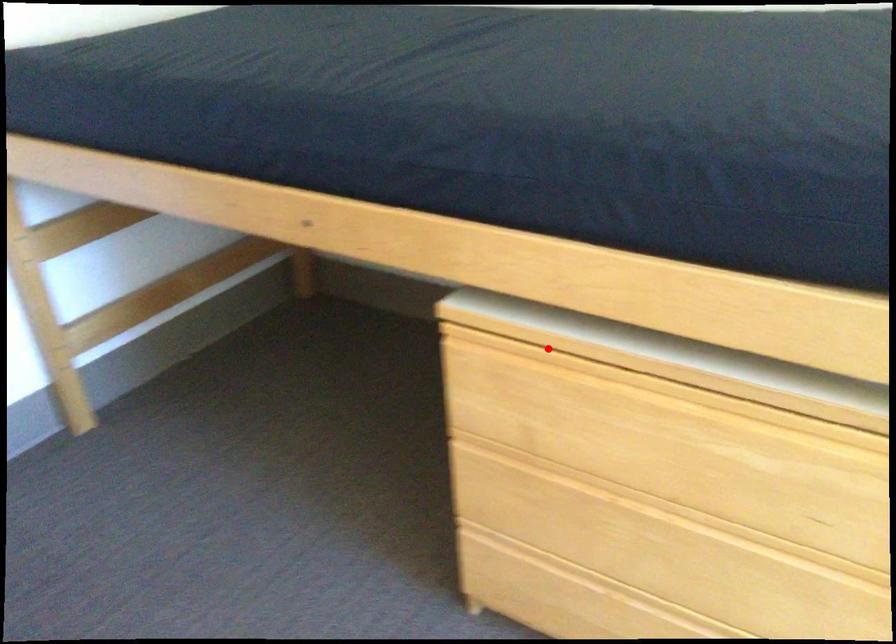
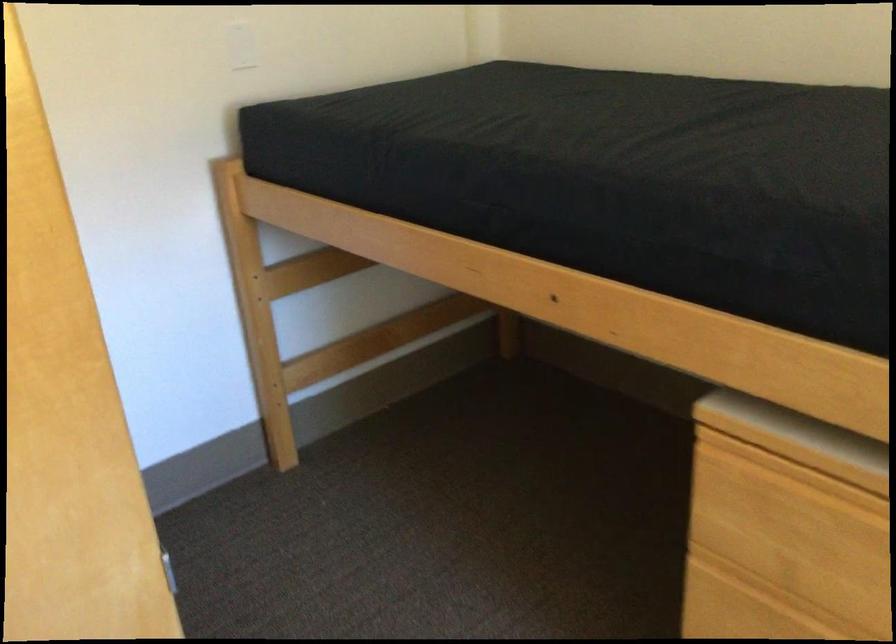
The point at the highlighted location is marked in the first image. Where is the corresponding point in the second image?

(837, 474)